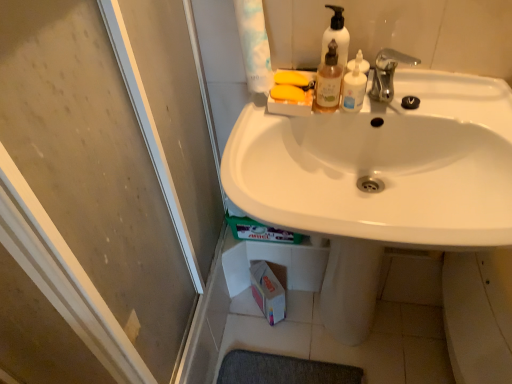
Identify the location of vacant space to the right of silver metallic faucet at upper center. This screenshot has height=384, width=512. (452, 100).